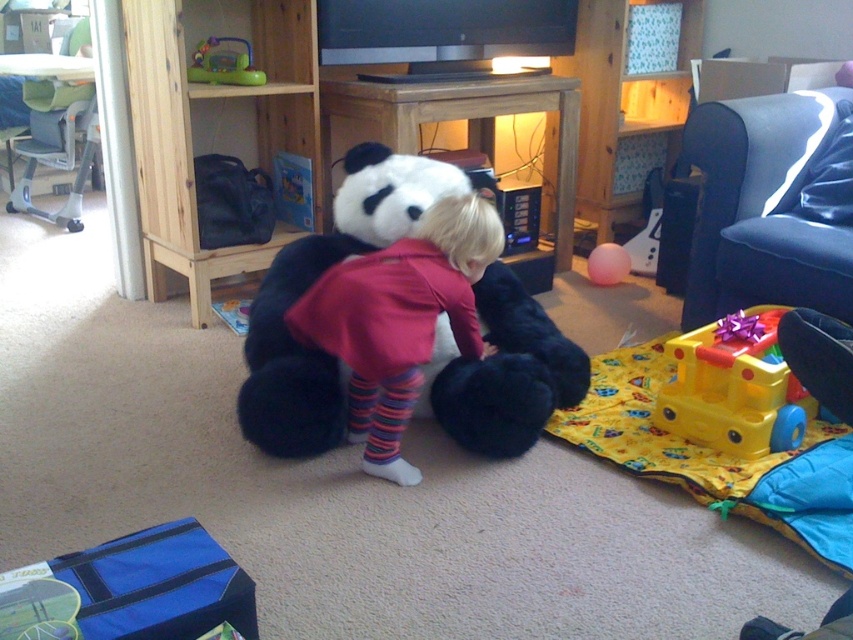
You are a parent trying to organize the living room. You want to move the yellow plastic train at lower right and the rubber ball at center to the shelf. The shelf has a 1 meter width. Can both items fit side by side on the shelf without overlapping?

The yellow plastic train at lower right is positioned on the right side of rubber ball at center, but their exact widths are not provided. Without knowing their individual sizes, it is impossible to determine if they can fit side by side on the 1 meter shelf.

You are a delivery person who needs to place a new box that is 1 meter wide on the floor. You see the wooden entertainment center at center and the yellow plastic train at lower right. Which object should you avoid placing the box next to to ensure there is enough space?

The wooden entertainment center at center is wider than the yellow plastic train at lower right, so you should avoid placing the box next to the wooden entertainment center at center to ensure enough space.